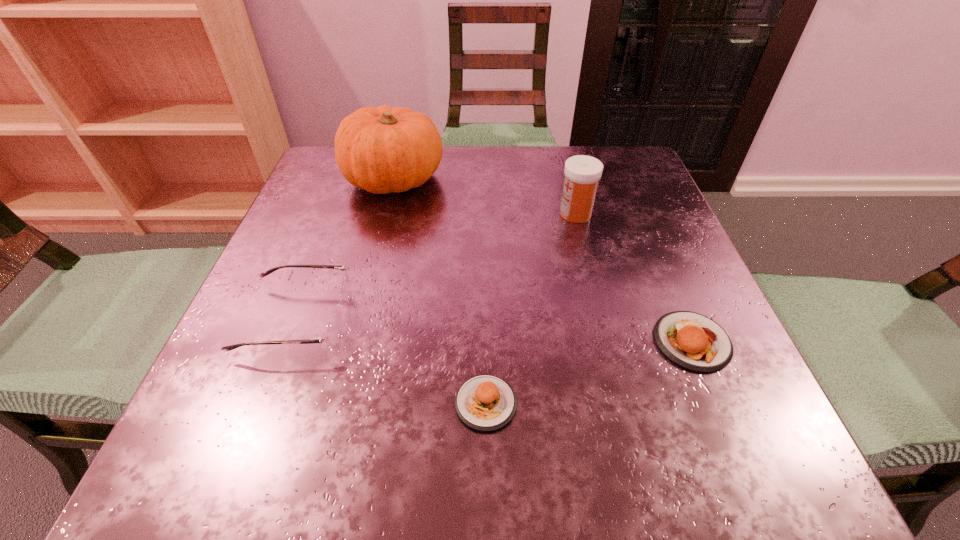
Where is `pumpkin`? The height and width of the screenshot is (540, 960). pumpkin is located at coordinates (381, 150).

The width and height of the screenshot is (960, 540). What are the coordinates of `the fourth object from left to right` in the screenshot? It's located at click(x=582, y=173).

Where is `medicine`? medicine is located at coordinates (582, 173).

Find the location of a particular element. The height and width of the screenshot is (540, 960). spectacles is located at coordinates (332, 335).

In order to click on the farther food in this screenshot , I will do `click(693, 341)`.

Locate an element on the screen. The image size is (960, 540). the fourth tallest object is located at coordinates (693, 341).

The width and height of the screenshot is (960, 540). I want to click on the nearer food, so click(x=485, y=402).

This screenshot has height=540, width=960. Identify the location of the third object from left to right. (485, 402).

Locate an element on the screen. This screenshot has width=960, height=540. vacant space located on the right of the pumpkin is located at coordinates (616, 179).

I want to click on vacant area situated on the left of the fourth object from left to right, so click(x=414, y=213).